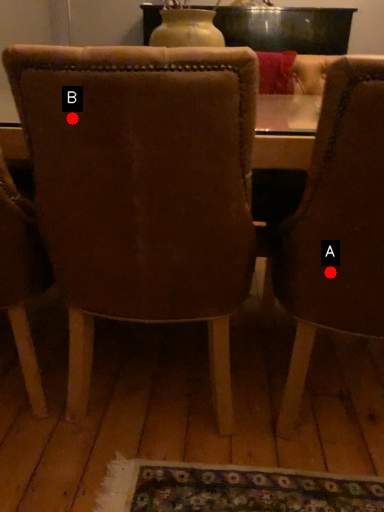
Question: Two points are circled on the image, labeled by A and B beside each circle. Which point is closer to the camera?

Choices:
 (A) A is closer
 (B) B is closer

Answer: (B)